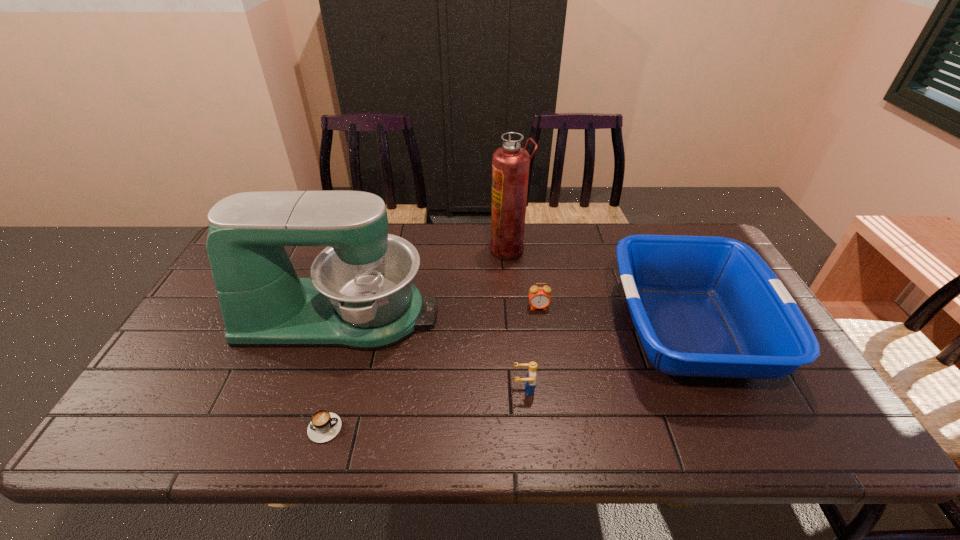
Identify the location of free space located 0.150m on the side of the farthest object with the label. The width and height of the screenshot is (960, 540). (444, 249).

Find the location of a particular element. This screenshot has width=960, height=540. free space located on the front-facing side of the mixer is located at coordinates (462, 315).

Identify the location of free space located 0.120m on the left of the rightmost object. The image size is (960, 540). (568, 330).

Where is `vacant space located 0.340m on the face of the Lego`? Image resolution: width=960 pixels, height=540 pixels. vacant space located 0.340m on the face of the Lego is located at coordinates (372, 389).

Where is `free location located on the face of the Lego`? The image size is (960, 540). free location located on the face of the Lego is located at coordinates (430, 389).

Find the location of `free space located 0.330m on the face of the Lego`. free space located 0.330m on the face of the Lego is located at coordinates (376, 389).

Where is `vacant space situated 0.400m on the face of the alarm clock`? vacant space situated 0.400m on the face of the alarm clock is located at coordinates (558, 442).

Locate an element on the screen. vacant space located 0.140m with the handle on the side of the cappuccino is located at coordinates (404, 428).

Identify the location of object at the far edge. (510, 163).

Where is `object located at the near edge`? The height and width of the screenshot is (540, 960). object located at the near edge is located at coordinates (324, 426).